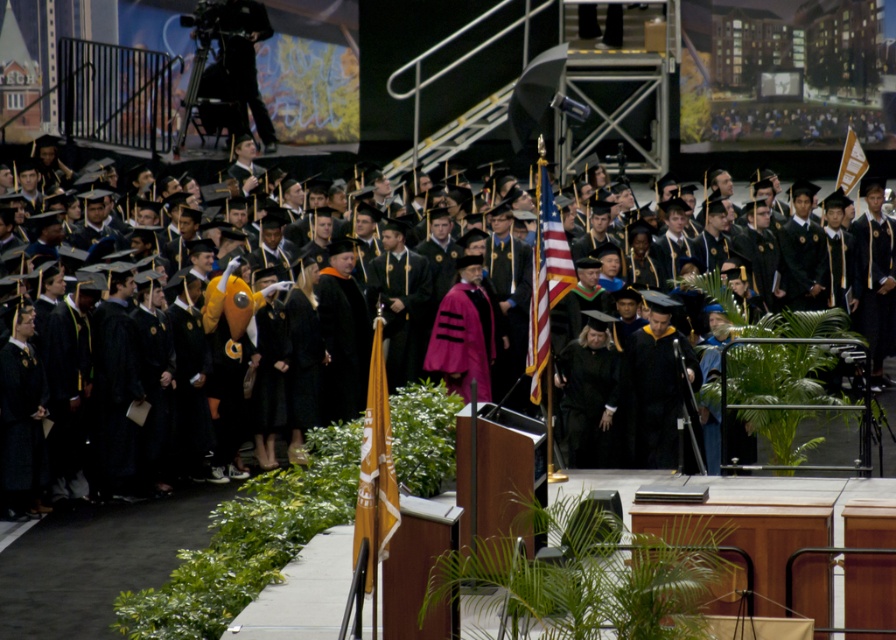
Question: Among these objects, which one is farthest from the camera?

Choices:
 (A) orange fabric flag at upper right
 (B) american flag at center

Answer: (A)

Question: Does matte black graduation gown at center have a smaller size compared to orange fabric flag at center?

Choices:
 (A) no
 (B) yes

Answer: (A)

Question: Which object is the closest to the matte black graduation gown at center?

Choices:
 (A) orange fabric flag at center
 (B) orange fabric flag at upper right

Answer: (A)

Question: Is the position of orange fabric flag at center less distant than that of american flag at center?

Choices:
 (A) yes
 (B) no

Answer: (A)

Question: Does matte black graduation gown at center appear over orange fabric flag at upper right?

Choices:
 (A) yes
 (B) no

Answer: (B)

Question: Considering the real-world distances, which object is closest to the orange fabric flag at upper right?

Choices:
 (A) orange fabric flag at center
 (B) matte black graduation gown at center
 (C) american flag at center

Answer: (B)